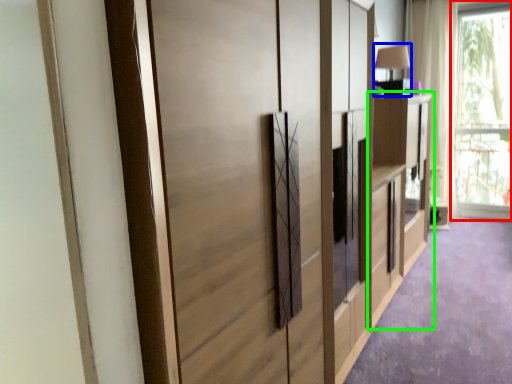
Question: Which object is positioned closest to window (highlighted by a red box)? Select from table lamp (highlighted by a blue box) and cabinetry (highlighted by a green box).

Choices:
 (A) table lamp
 (B) cabinetry

Answer: (B)